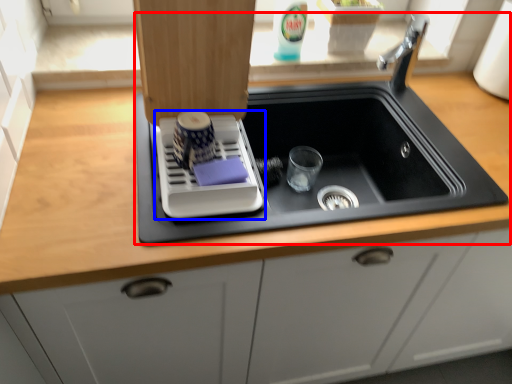
Question: Which object is closer to the camera taking this photo, sink (highlighted by a red box) or appliance (highlighted by a blue box)?

Choices:
 (A) sink
 (B) appliance

Answer: (B)